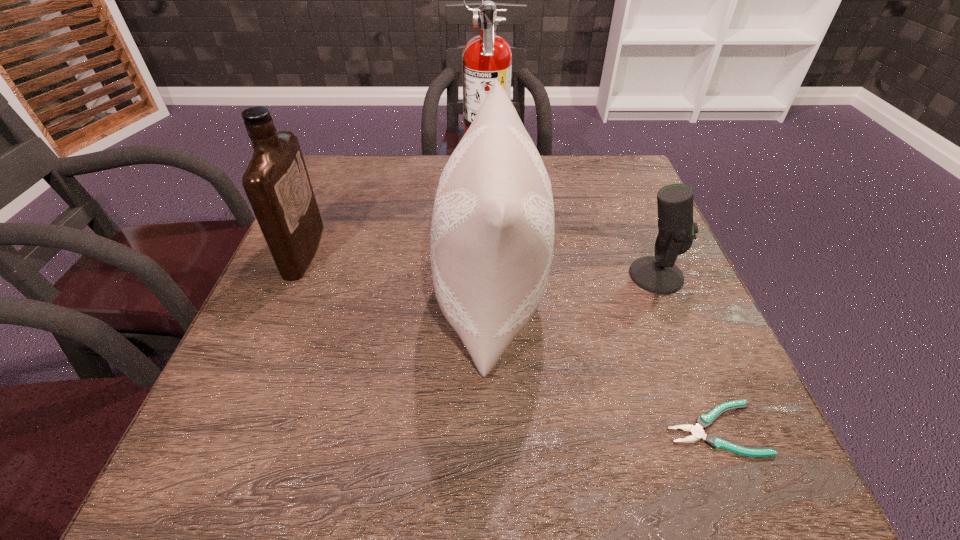
Image resolution: width=960 pixels, height=540 pixels. Find the location of `vacant region that satisfies the following two spatial constraints: 1. on the nozzle side of the fire extinguisher; 2. on the back side of the microphone`. vacant region that satisfies the following two spatial constraints: 1. on the nozzle side of the fire extinguisher; 2. on the back side of the microphone is located at coordinates (489, 275).

You are a GUI agent. You are given a task and a screenshot of the screen. Output one action in this format:
    pyautogui.click(x=<x>, y=<y>)
    Task: Click on the free location that satisfies the following two spatial constraints: 1. on the nozzle side of the tallest object; 2. on the right side of the nearest object
    The height and width of the screenshot is (540, 960).
    Given the screenshot: What is the action you would take?
    pyautogui.click(x=492, y=429)

The height and width of the screenshot is (540, 960). In order to click on free space that satisfies the following two spatial constraints: 1. on the back side of the shortest object; 2. on the nozzle side of the tallest object in this screenshot , I will do `click(612, 174)`.

Locate an element on the screen. The height and width of the screenshot is (540, 960). vacant space that satisfies the following two spatial constraints: 1. on the nozzle side of the farthest object; 2. on the back side of the microphone is located at coordinates (489, 275).

The height and width of the screenshot is (540, 960). Find the location of `vacant region that satisfies the following two spatial constraints: 1. on the nozzle side of the farthest object; 2. on the right side of the microphone`. vacant region that satisfies the following two spatial constraints: 1. on the nozzle side of the farthest object; 2. on the right side of the microphone is located at coordinates (489, 275).

You are a GUI agent. You are given a task and a screenshot of the screen. Output one action in this format:
    pyautogui.click(x=<x>, y=<y>)
    Task: Click on the vacant space that satisfies the following two spatial constraints: 1. on the front side of the fourth tallest object; 2. on the front side of the cushion
    
    Given the screenshot: What is the action you would take?
    pyautogui.click(x=665, y=298)